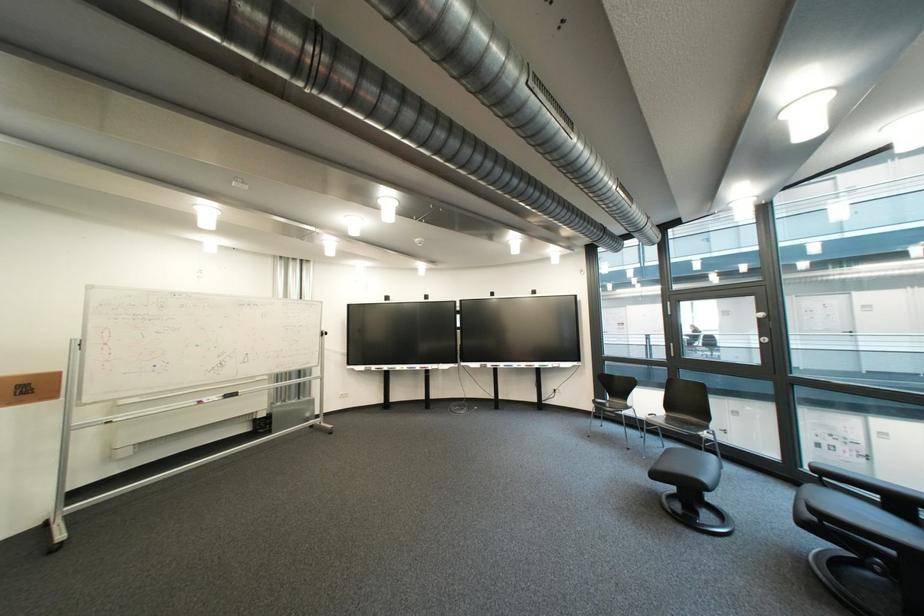
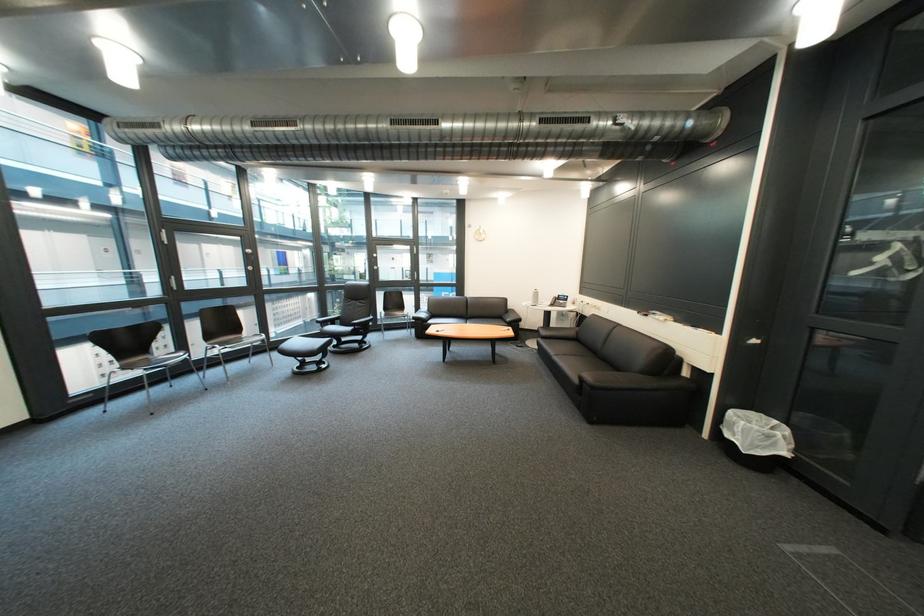
Find the pixel in the second image that matches the point at 827,524 in the first image.

(366, 331)